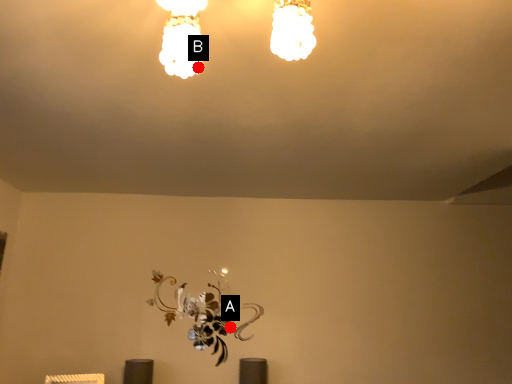
Question: Two points are circled on the image, labeled by A and B beside each circle. Which point is closer to the camera?

Choices:
 (A) A is closer
 (B) B is closer

Answer: (B)